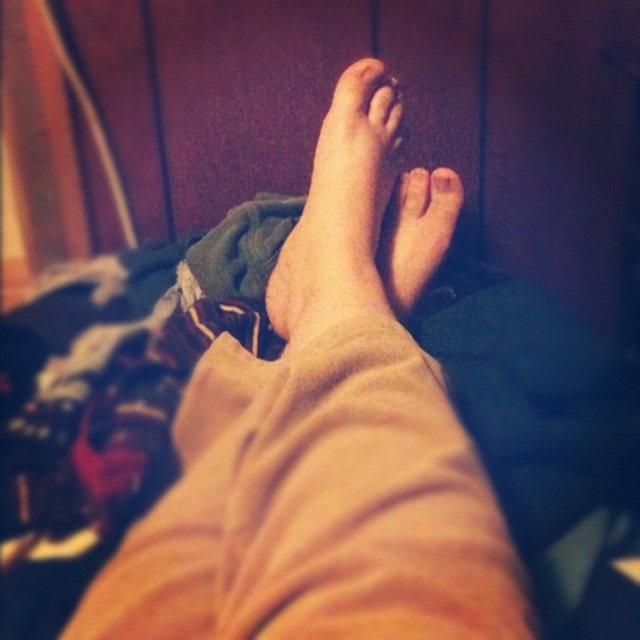
Which is below, skinny beige foot at center or smooth skin foot at center?

Positioned lower is skinny beige foot at center.

Which is more to the left, skinny beige foot at center or smooth skin foot at center?

Positioned to the left is skinny beige foot at center.

Which is in front, point (368, 141) or point (444, 170)?

Point (368, 141)

Find the location of a particular element. skinny beige foot at center is located at coordinates (339, 220).

Is skinny beige foot at center thinner than smooth skin toe at center?

No.

Between point (364, 81) and point (410, 193), which one is positioned behind?

The point (410, 193) is more distant.

The width and height of the screenshot is (640, 640). I want to click on skinny beige foot at center, so click(339, 220).

Does skinny beige pants at center have a smaller size compared to smooth skin foot at center?

No, skinny beige pants at center is not smaller than smooth skin foot at center.

The height and width of the screenshot is (640, 640). What do you see at coordinates (320, 456) in the screenshot? I see `skinny beige pants at center` at bounding box center [320, 456].

Image resolution: width=640 pixels, height=640 pixels. Find the location of `skinny beige pants at center`. skinny beige pants at center is located at coordinates (320, 456).